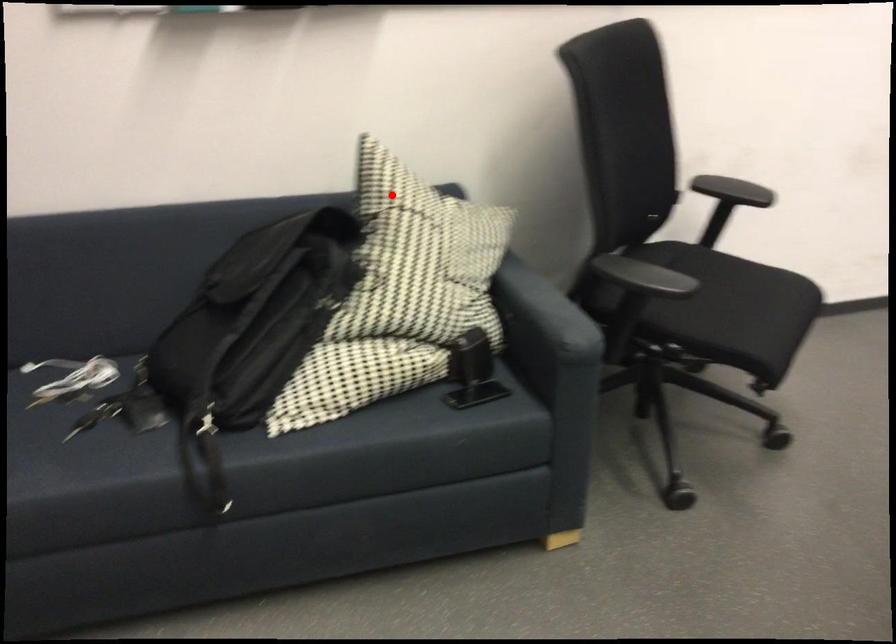
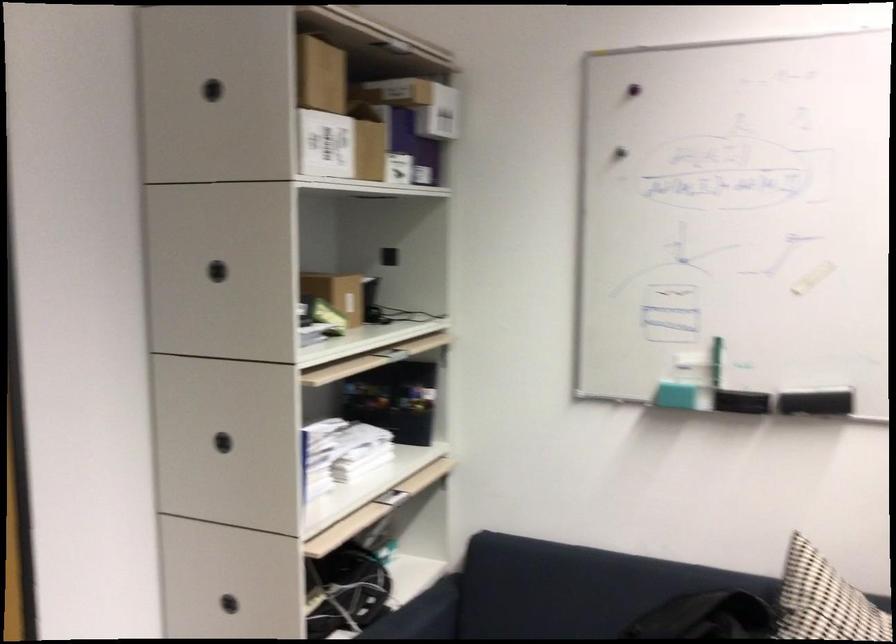
The point at the highlighted location is marked in the first image. Where is the corresponding point in the second image?

(823, 601)